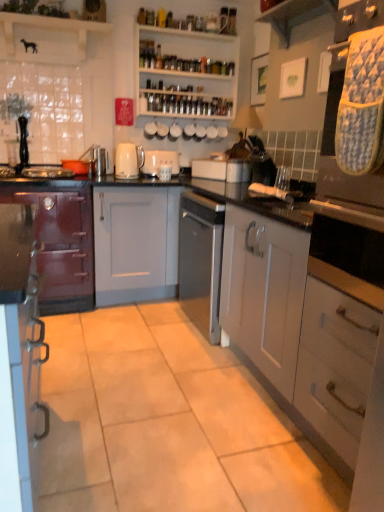
Question: From the image's perspective, is satin silver toaster at center, which is the 1th appliance from bottom to top, on matte gray cabinet at center, acting as the second cabinetry starting from the left?

Choices:
 (A) no
 (B) yes

Answer: (B)

Question: Does satin silver toaster at center, which is the first appliance from right to left, have a lesser height compared to matte gray cabinet at center, acting as the second cabinetry starting from the left?

Choices:
 (A) yes
 (B) no

Answer: (A)

Question: Is satin silver toaster at center, which is the 1th appliance from bottom to top, facing towards matte gray cabinet at center, which ranks as the 2th cabinetry in right-to-left order?

Choices:
 (A) yes
 (B) no

Answer: (B)

Question: Is satin silver toaster at center, which is the 1th appliance from bottom to top, taller than matte gray cabinet at center, which ranks as the 2th cabinetry in right-to-left order?

Choices:
 (A) yes
 (B) no

Answer: (B)

Question: Is satin silver toaster at center, the second appliance when ordered from back to front, further to the viewer compared to matte gray cabinet at center, which ranks as the 2th cabinetry in right-to-left order?

Choices:
 (A) yes
 (B) no

Answer: (B)

Question: From a real-world perspective, is satin silver toaster at center, which is the first appliance from right to left, located higher than matte gray cabinet at center, which ranks as the 2th cabinetry in right-to-left order?

Choices:
 (A) no
 (B) yes

Answer: (B)

Question: Is white matte toaster at center, positioned as the second appliance in right-to-left order, oriented towards white matte cabinet at center, marked as the 3th cabinetry in a left-to-right arrangement?

Choices:
 (A) no
 (B) yes

Answer: (B)

Question: Does white matte toaster at center, placed as the 1th appliance when sorted from back to front, have a larger size compared to white matte cabinet at center, which ranks as the first cabinetry in right-to-left order?

Choices:
 (A) no
 (B) yes

Answer: (A)

Question: Does white matte toaster at center, acting as the 2th appliance starting from the front, come behind white matte cabinet at center, which ranks as the first cabinetry in right-to-left order?

Choices:
 (A) yes
 (B) no

Answer: (A)

Question: Can you see white matte toaster at center, acting as the 2th appliance starting from the front, touching white matte cabinet at center, which ranks as the first cabinetry in right-to-left order?

Choices:
 (A) no
 (B) yes

Answer: (A)

Question: Could white matte cabinet at center, which ranks as the first cabinetry in right-to-left order, be considered to be inside white matte toaster at center, positioned as the second appliance in right-to-left order?

Choices:
 (A) yes
 (B) no

Answer: (B)

Question: From the image's perspective, is white matte toaster at center, positioned as the second appliance in right-to-left order, over white matte cabinet at center, which ranks as the first cabinetry in right-to-left order?

Choices:
 (A) no
 (B) yes

Answer: (B)

Question: Is wooden shelf at upper center, positioned as the 2th shelf in back-to-front order, to the left of white matte toaster at center, the 1th appliance viewed from the left, from the viewer's perspective?

Choices:
 (A) no
 (B) yes

Answer: (B)